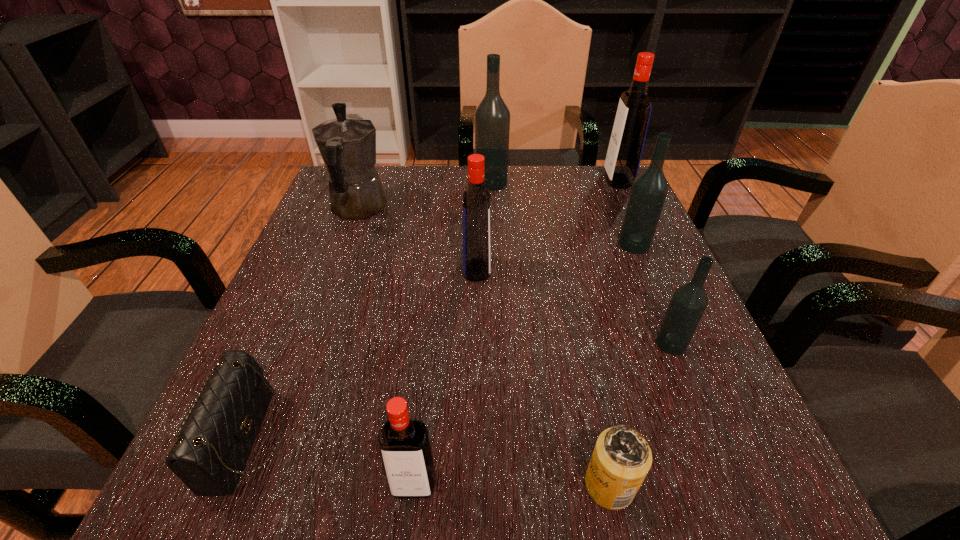
Locate an element on the screen. This screenshot has width=960, height=540. the smallest black vodka is located at coordinates (688, 303).

The width and height of the screenshot is (960, 540). Identify the location of the nearest red vodka. (404, 444).

Find the location of `the nearest vodka`. the nearest vodka is located at coordinates (404, 444).

This screenshot has height=540, width=960. What are the coordinates of `the sixth object from left to right` in the screenshot? It's located at (621, 459).

Where is `clutch bag`? This screenshot has width=960, height=540. clutch bag is located at coordinates (209, 455).

This screenshot has height=540, width=960. What are the coordinates of `free space located 0.050m on the front and back of the biggest red vodka` in the screenshot? It's located at (586, 180).

The height and width of the screenshot is (540, 960). I want to click on free space located on the front and back of the biggest red vodka, so (x=582, y=180).

Where is `vacant point located 0.260m on the front and back of the biggest red vodka`? vacant point located 0.260m on the front and back of the biggest red vodka is located at coordinates (503, 180).

At what (x,y) coordinates should I click in order to perform the action: click on vacant space situated on the front of the farthest black vodka. Please return your answer as a coordinate pair (x, y). This screenshot has height=540, width=960. Looking at the image, I should click on (x=495, y=300).

The height and width of the screenshot is (540, 960). I want to click on vacant space located 0.070m on the pouring side of the coffeepot, so click(x=372, y=172).